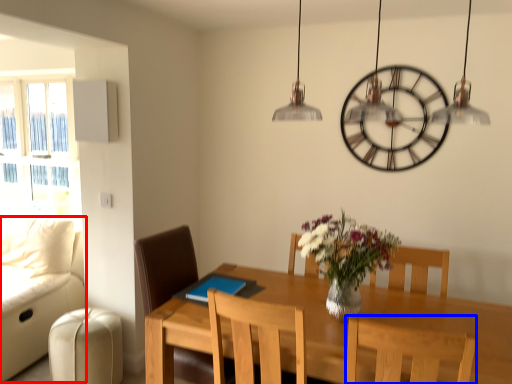
Question: Which object appears farthest to the camera in this image, couch (highlighted by a red box) or chair (highlighted by a blue box)?

Choices:
 (A) couch
 (B) chair

Answer: (A)